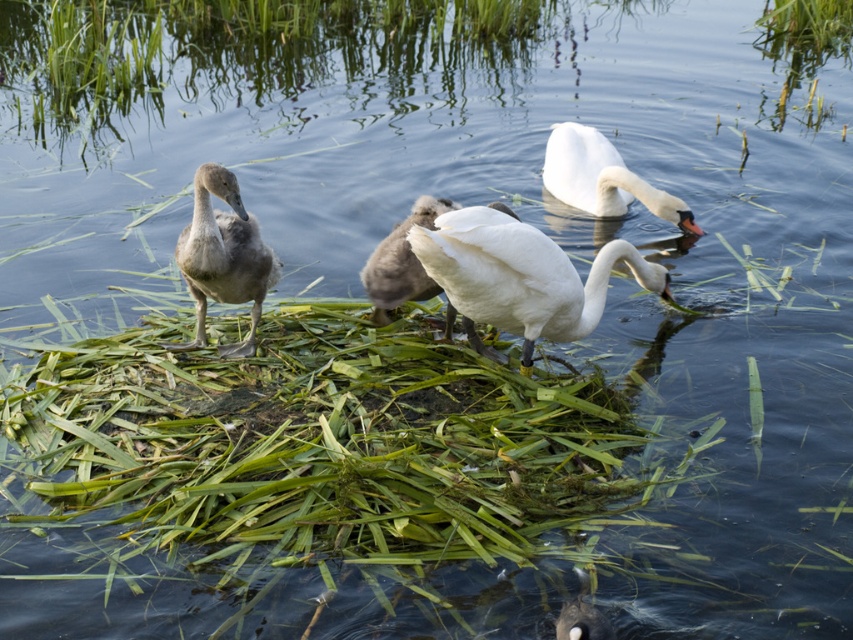
Question: Is gray downy duckling at left above white matte swan at center?

Choices:
 (A) no
 (B) yes

Answer: (A)

Question: Among these points, which one is farthest from the camera?

Choices:
 (A) (585, 134)
 (B) (192, 284)
 (C) (422, 280)
 (D) (534, 298)

Answer: (A)

Question: Which point is closer to the camera taking this photo?

Choices:
 (A) (445, 314)
 (B) (616, 212)

Answer: (A)

Question: Does gray downy duckling at left have a smaller size compared to white glossy swan at upper center?

Choices:
 (A) no
 (B) yes

Answer: (B)

Question: Which point is farther from the camera taking this photo?

Choices:
 (A) (445, 198)
 (B) (660, 218)
 (C) (201, 326)

Answer: (B)

Question: Observing the image, what is the correct spatial positioning of white glossy swan at center in reference to gray downy duckling at left?

Choices:
 (A) below
 (B) above

Answer: (A)